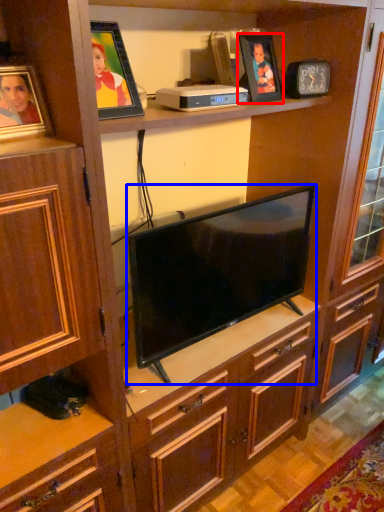
Question: Which point is closer to the camera, picture frame (highlighted by a red box) or television (highlighted by a blue box)?

Choices:
 (A) picture frame
 (B) television

Answer: (B)